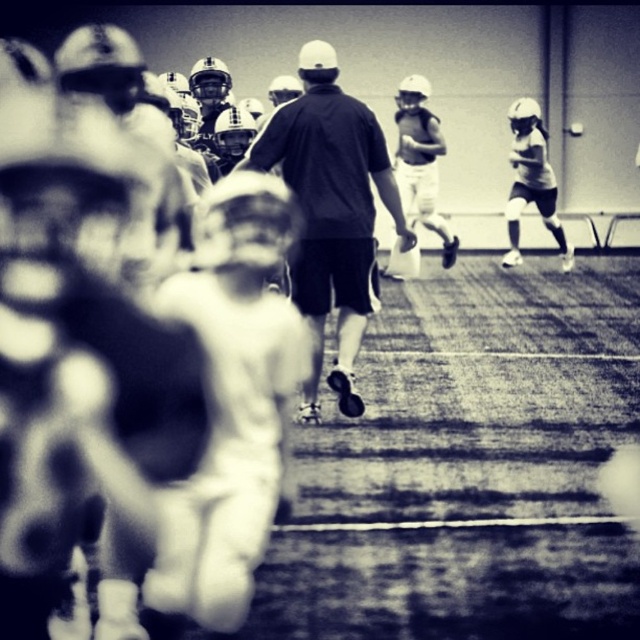
Find the location of a particular element. The image size is (640, 640). black matte shirt at center is located at coordinates (332, 211).

Between black matte shirt at center and white matte shorts at right, which one appears on the left side from the viewer's perspective?

Positioned to the left is black matte shirt at center.

Does point (314, 337) come behind point (515, 128)?

No, (314, 337) is in front of (515, 128).

I want to click on black matte shirt at center, so click(x=332, y=211).

Which is behind, point (412, 115) or point (515, 225)?

The point (412, 115) is behind.

Is point (419, 138) in front of point (532, 163)?

No, (419, 138) is behind (532, 163).

You are a GUI agent. You are given a task and a screenshot of the screen. Output one action in this format:
    pyautogui.click(x=<x>, y=<y>)
    Task: Click on the smooth white tank top at center
    This screenshot has height=640, width=640.
    Given the screenshot: What is the action you would take?
    pyautogui.click(x=420, y=161)

Where is `smooth white tank top at center`? This screenshot has height=640, width=640. smooth white tank top at center is located at coordinates (420, 161).

How much distance is there between black matte shirt at center and smooth white tank top at center?

The distance of black matte shirt at center from smooth white tank top at center is 22.46 feet.

Can you confirm if black matte shirt at center is taller than smooth white tank top at center?

Correct, black matte shirt at center is much taller as smooth white tank top at center.

Is point (298, 284) in front of point (420, 186)?

Yes.

Where is `black matte shirt at center`? This screenshot has width=640, height=640. black matte shirt at center is located at coordinates coord(332,211).